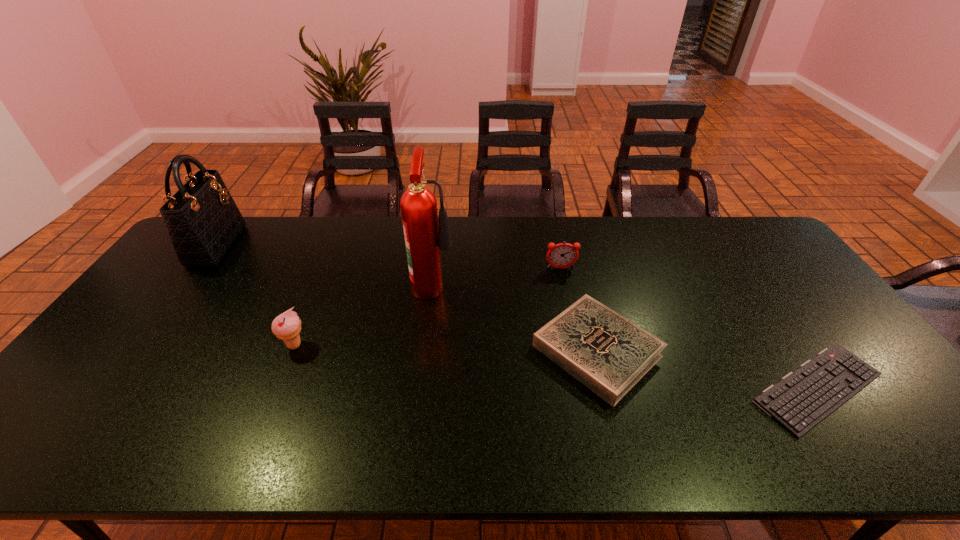
Find the location of a particular element. The width and height of the screenshot is (960, 540). the third object from left to right is located at coordinates (424, 239).

I want to click on the tallest object, so click(x=424, y=239).

You are a GUI agent. You are given a task and a screenshot of the screen. Output one action in this format:
    pyautogui.click(x=<x>, y=<y>)
    Task: Click on the handbag
    
    Given the screenshot: What is the action you would take?
    pyautogui.click(x=203, y=222)

This screenshot has width=960, height=540. In order to click on the leftmost object in this screenshot , I will do `click(203, 222)`.

Locate an element on the screen. the fifth object from right to left is located at coordinates (287, 326).

The image size is (960, 540). What are the coordinates of `the fourth shortest object` in the screenshot? It's located at (287, 326).

Identify the location of alarm clock. (562, 255).

Identify the location of the fifth tallest object. The height and width of the screenshot is (540, 960). click(609, 354).

The width and height of the screenshot is (960, 540). Identify the location of the rightmost object. pyautogui.click(x=803, y=398).

This screenshot has height=540, width=960. Identify the location of computer keyboard. (803, 398).